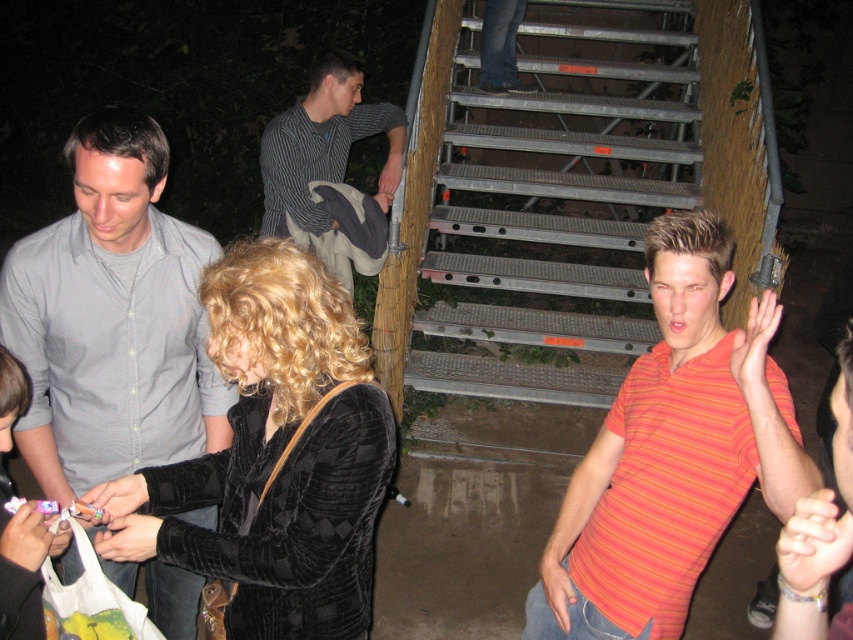
Question: Is velvet black jacket at center bigger than striped shirt at upper center?

Choices:
 (A) no
 (B) yes

Answer: (A)

Question: Which point is farther from the camera taking this photo?

Choices:
 (A) (639, 492)
 (B) (670, 93)

Answer: (B)

Question: Estimate the real-world distances between objects in this image. Which object is farther from the orange striped polo shirt at right?

Choices:
 (A) metallic gray stairs at upper center
 (B) striped shirt at upper center

Answer: (A)

Question: Is orange striped shirt at right thinner than orange striped polo shirt at right?

Choices:
 (A) no
 (B) yes

Answer: (A)

Question: Which of the following is the farthest from the observer?

Choices:
 (A) (88, 365)
 (B) (573, 609)

Answer: (A)

Question: Is metallic gray stairs at upper center wider than velvet black jacket at center?

Choices:
 (A) no
 (B) yes

Answer: (B)